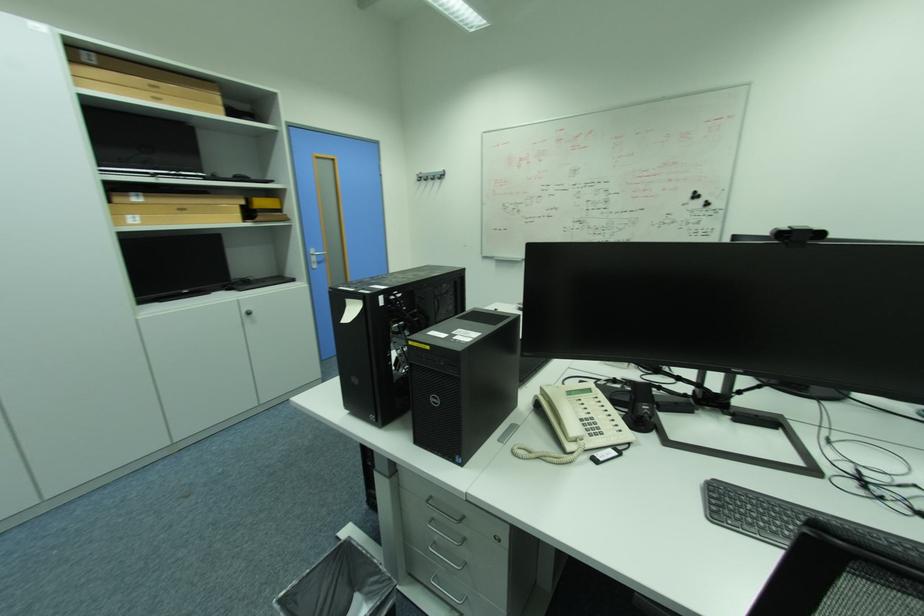
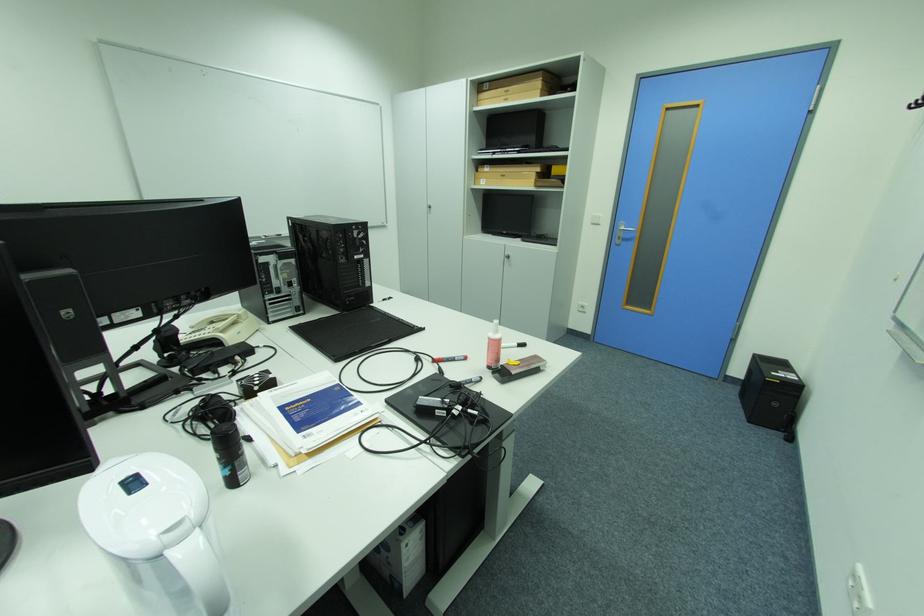
Find the pixel in the second image that matches the point at 136,217 in the first image.

(490, 180)